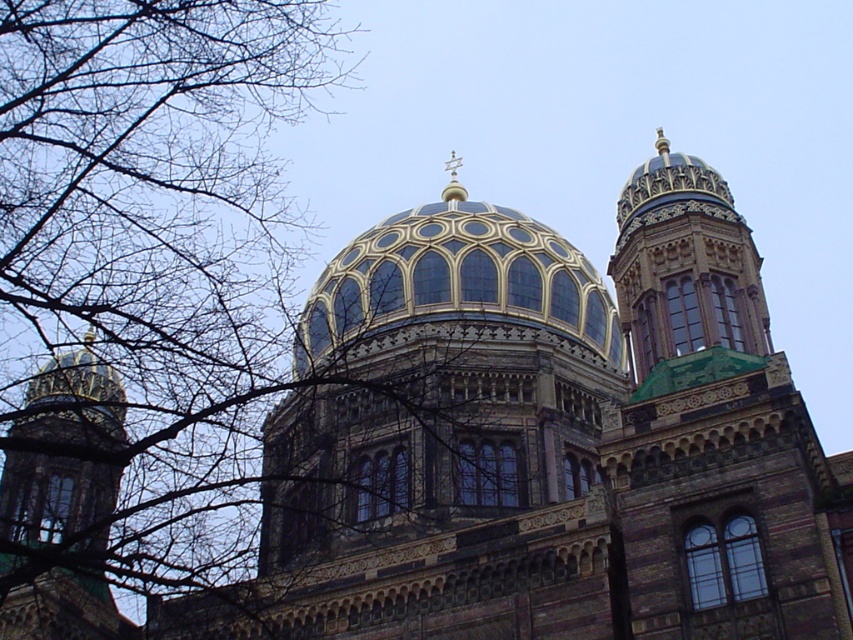
You are an architect designing a new building and want to incorporate elements from this synagogue. You have two domes to place on your design. The blue glass dome at center and the shiny gold dome at upper right. Which dome should you place higher to match the original structure?

The blue glass dome at center should be placed higher since it is much taller than the shiny gold dome at upper right in the original structure.

You are standing in front of the grand synagogue and notice two elements in the image. One is the bare branches at upper left and the other is the blue glass dome at center. Which of these two elements is located to the left of the other?

The bare branches at upper left is positioned on the left side of blue glass dome at center, so the bare branches at upper left is to the left of the blue glass dome at center.

You are a drone operator tasked with capturing aerial footage of the synagogue. Your drone is currently positioned near the bare branches at upper left. The client wants a shot of the blue glass dome at center. Considering the distance between them, can your drone safely navigate the space to film the dome without any obstacles?

The distance between the bare branches at upper left and the blue glass dome at center is 66.23 feet. Since there are no mentioned obstacles in the scene description, the drone can safely navigate the space to film the dome.